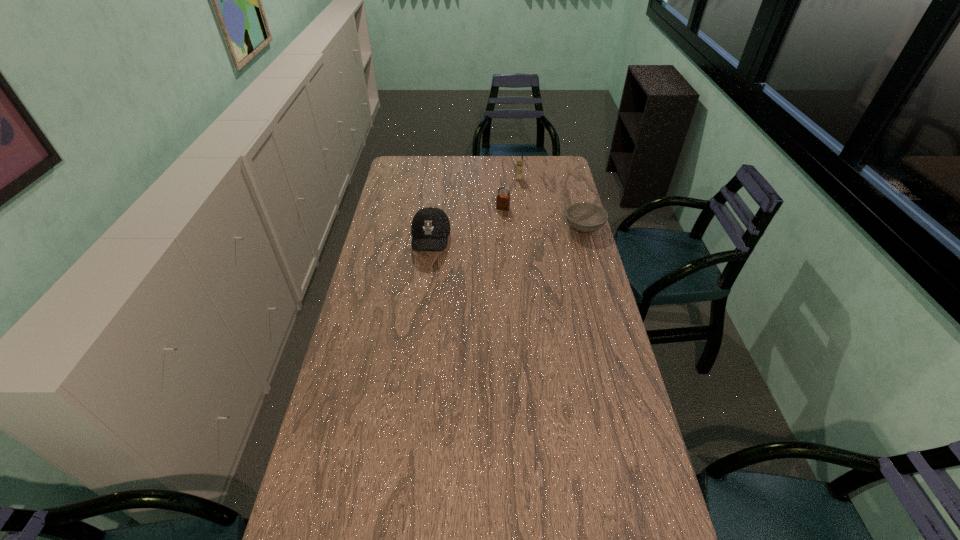
In the image, there is a desktop. Identify the location of vacant space at the right edge. (649, 467).

Find the location of a particular element. This screenshot has height=540, width=960. vacant area at the far left corner of the desktop is located at coordinates (405, 168).

The image size is (960, 540). Identify the location of free area in between the leftmost object and the rightmost object. (508, 234).

This screenshot has height=540, width=960. Find the location of `free area in between the rightmost object and the tallest object`. free area in between the rightmost object and the tallest object is located at coordinates (552, 202).

This screenshot has height=540, width=960. In order to click on vacant area that lies between the padlock and the bowl in this screenshot , I will do `click(543, 218)`.

In order to click on vacant space in between the baseball cap and the padlock in this screenshot , I will do `click(467, 225)`.

Where is `free space between the rightmost object and the cellular telephone`? The image size is (960, 540). free space between the rightmost object and the cellular telephone is located at coordinates tap(552, 202).

You are a GUI agent. You are given a task and a screenshot of the screen. Output one action in this format:
    pyautogui.click(x=<x>, y=<y>)
    Task: Click on the free space between the third object from left to right and the second object from left to right
    The height and width of the screenshot is (540, 960).
    Given the screenshot: What is the action you would take?
    pyautogui.click(x=511, y=194)

This screenshot has width=960, height=540. What are the coordinates of `empty space that is in between the baseball cap and the tallest object` in the screenshot? It's located at (475, 210).

The image size is (960, 540). Identify the location of free point between the baseball cap and the second farthest object. (467, 225).